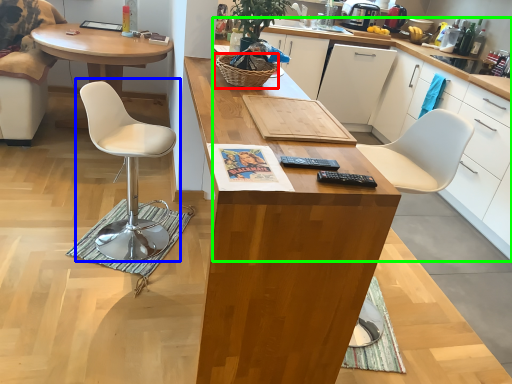
Question: Estimate the real-world distances between objects in this image. Which object is closer to picnic basket (highlighted by a red box), chair (highlighted by a blue box) or cabinetry (highlighted by a green box)?

Choices:
 (A) chair
 (B) cabinetry

Answer: (A)